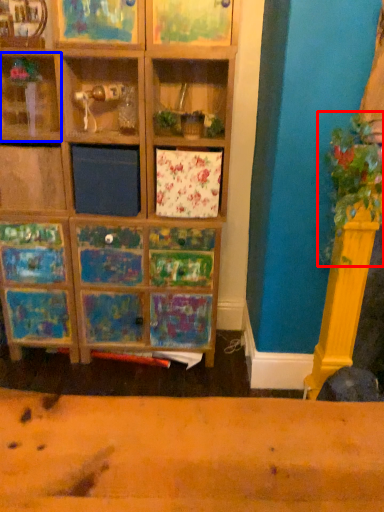
Question: Among these objects, which one is farthest to the camera, plant (highlighted by a red box) or shelf (highlighted by a blue box)?

Choices:
 (A) plant
 (B) shelf

Answer: (B)